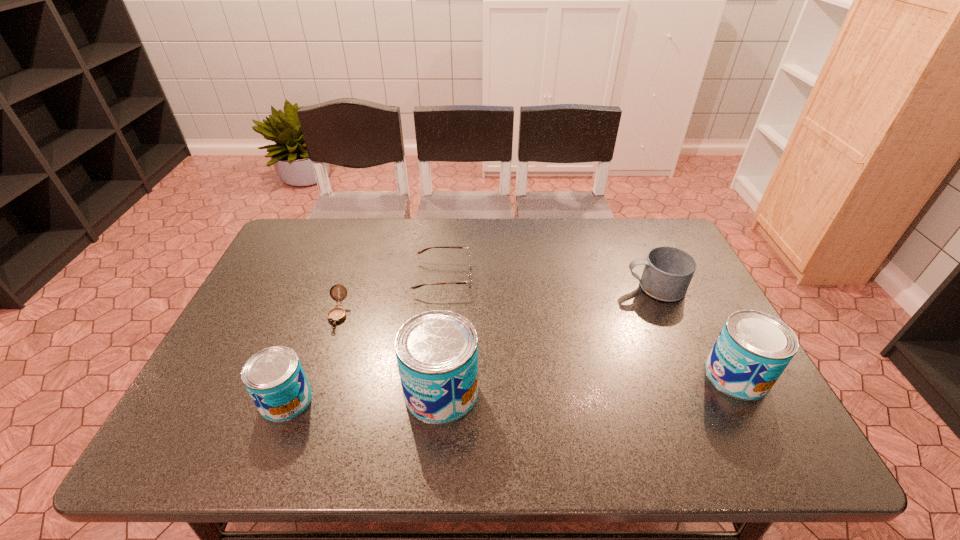
The image size is (960, 540). Identify the location of the shortest can. (274, 377).

Image resolution: width=960 pixels, height=540 pixels. Find the location of `the leftmost can`. the leftmost can is located at coordinates (274, 377).

Where is `the tallest can`? The image size is (960, 540). the tallest can is located at coordinates (437, 351).

Find the location of `the tallest object`. the tallest object is located at coordinates (437, 351).

Identify the location of the rightmost can. The width and height of the screenshot is (960, 540). (753, 349).

Find the location of a particular element. Image resolution: width=960 pixels, height=540 pixels. the second tallest can is located at coordinates (753, 349).

At what (x,y) coordinates should I click in order to perform the action: click on compass. Please return your answer as a coordinate pair (x, y). Image resolution: width=960 pixels, height=540 pixels. Looking at the image, I should click on (337, 314).

Locate an element on the screen. This screenshot has width=960, height=540. spectacles is located at coordinates (468, 281).

This screenshot has width=960, height=540. Identify the location of mug. (668, 271).

Where is `free space located 0.220m on the back of the fourth shortest object`? This screenshot has width=960, height=540. free space located 0.220m on the back of the fourth shortest object is located at coordinates (320, 313).